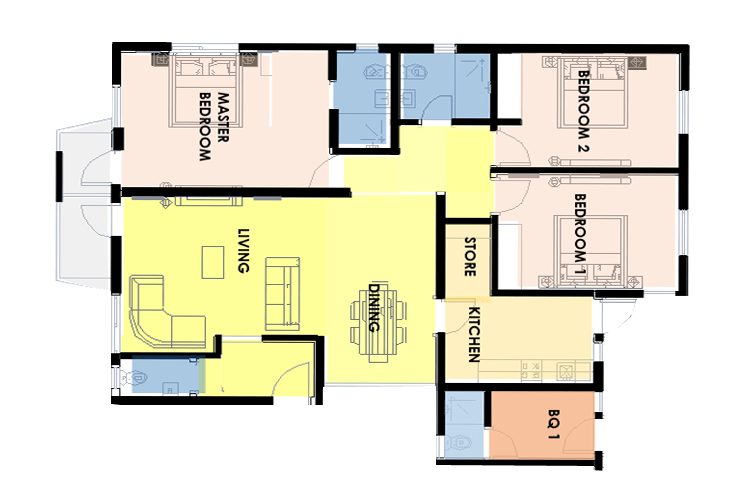
Identify the location of corner sofa. The height and width of the screenshot is (500, 750). (168, 325).